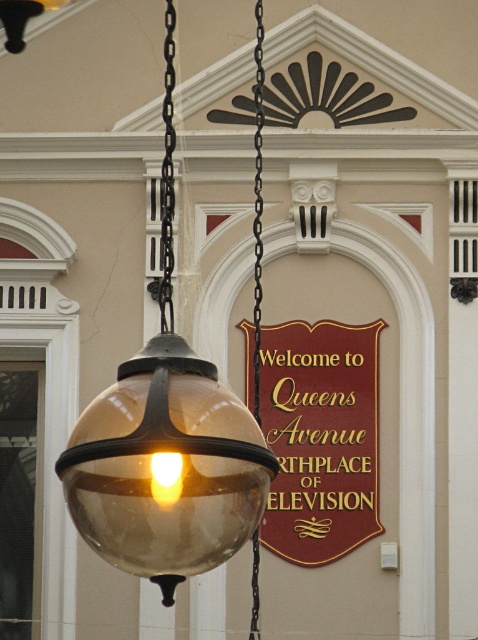
You are an interior designer assessing the lighting setup. The translucent glass globe at center and the black metal chain at upper center are part of the fixture. Which object is taller?

The translucent glass globe at center is taller than the black metal chain at upper center according to the description.

You are standing in front of a building and see the maroon polished wood sign at center and the black metal chain at upper center. Which object appears smaller in the image?

The maroon polished wood sign at center appears smaller compared to the black metal chain at upper center.

You are standing in front of the building and notice the maroon polished wood sign at center and the black metal chain at upper center. Which object is nearer to you?

The maroon polished wood sign at center is closer to the viewer than the black metal chain at upper center.